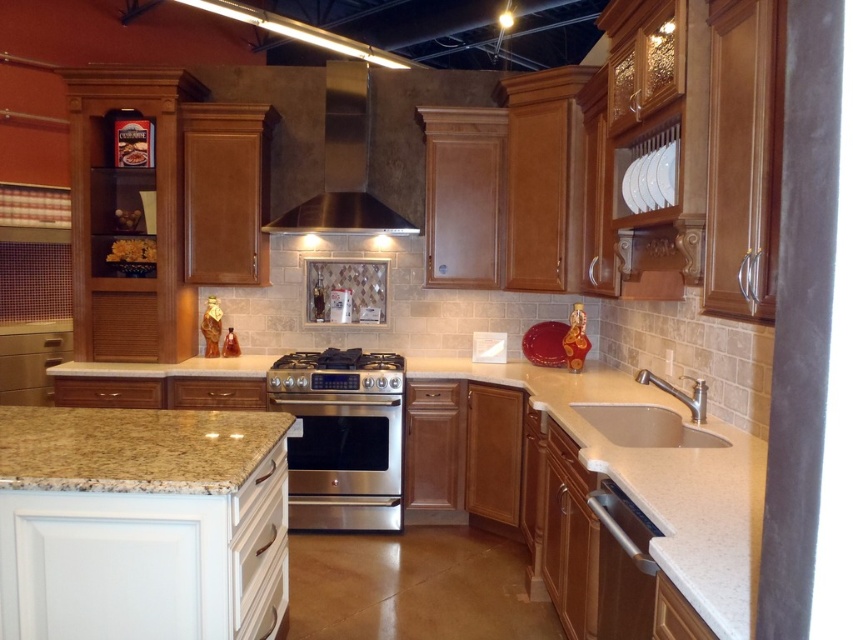
Is point (641, 522) farther from viewer compared to point (663, 433)?

No, (641, 522) is closer to viewer.

Can you confirm if satin stainless steel dishwasher at lower right is taller than white porcelain sink at lower right?

Yes.

At what (x,y) coordinates should I click in order to perform the action: click on satin stainless steel dishwasher at lower right. Please return your answer as a coordinate pair (x, y). This screenshot has width=853, height=640. Looking at the image, I should click on (624, 564).

In order to click on satin stainless steel dishwasher at lower right in this screenshot , I will do `click(624, 564)`.

Is stainless steel oven at center to the right of stainless steel exhaust hood at upper center from the viewer's perspective?

Incorrect, stainless steel oven at center is not on the right side of stainless steel exhaust hood at upper center.

Can you confirm if stainless steel oven at center is positioned above stainless steel exhaust hood at upper center?

No, stainless steel oven at center is not above stainless steel exhaust hood at upper center.

Is point (337, 497) more distant than point (345, 115)?

That is False.

Image resolution: width=853 pixels, height=640 pixels. I want to click on stainless steel oven at center, so click(x=344, y=460).

Does satin stainless steel dishwasher at lower right have a smaller size compared to stainless steel stove at center?

Correct, satin stainless steel dishwasher at lower right occupies less space than stainless steel stove at center.

Measure the distance from satin stainless steel dishwasher at lower right to stainless steel stove at center.

The distance of satin stainless steel dishwasher at lower right from stainless steel stove at center is 7.01 feet.

I want to click on satin stainless steel dishwasher at lower right, so click(624, 564).